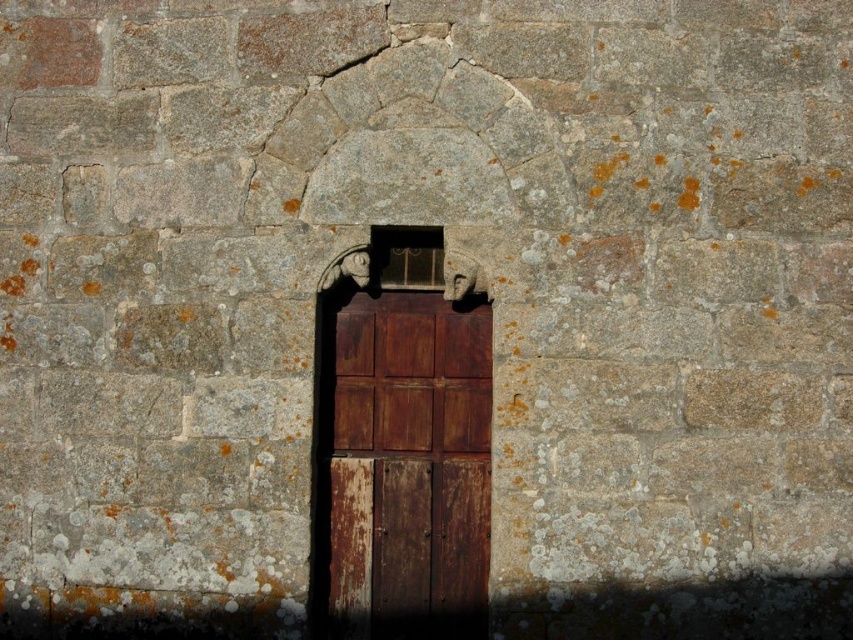
You are an architect examining the stone wall with an arched doorway. You need to determine the best path to approach the rusty wood door at center without obstructing your view of the matte metal window at center. Which object should you move closer to first?

The rusty wood door at center is closer to you than the matte metal window at center, so you should move closer to the matte metal window at center first to ensure it remains visible while approaching the door.

You are an architect designing a new door for the stone wall. The current rusty wood door at center is wider than the matte metal window at center. If you want the new door to align with the window in terms of width, how should you adjust the door size?

The rusty wood door at center is currently wider than the matte metal window at center. To align their widths, the new door should be made narrower to match the matte metal window at center.

You are standing in front of the stone wall with an arched doorway. You see a rusty wood door at center and a matte metal window at center. Which object is positioned to the right of the other?

The rusty wood door at center is to the right of the matte metal window at center.